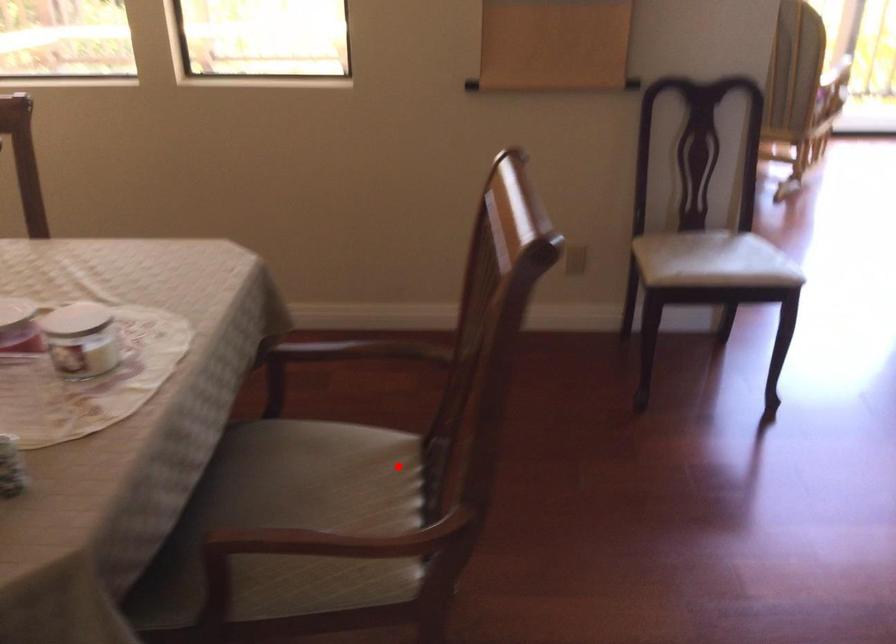
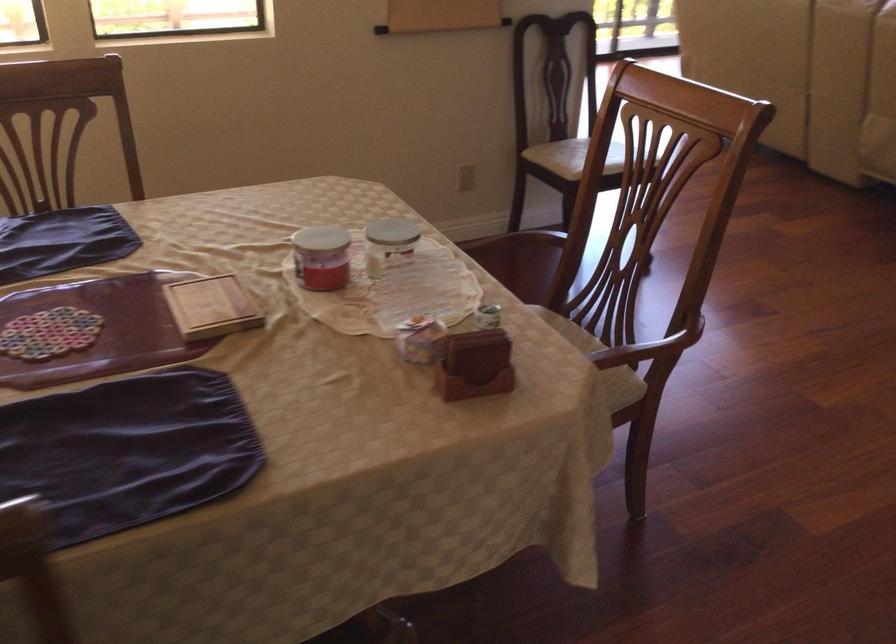
Question: I am providing you with two images of the same scene from different viewpoints. A red point is marked on the first image. Is the red point's position out of view in image 2?

Choices:
 (A) Yes
 (B) No

Answer: (B)